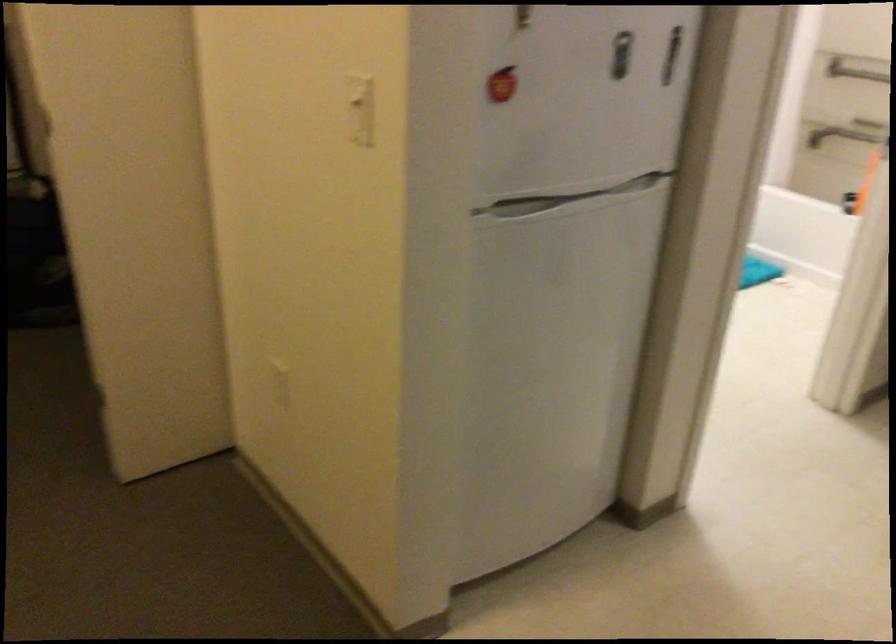
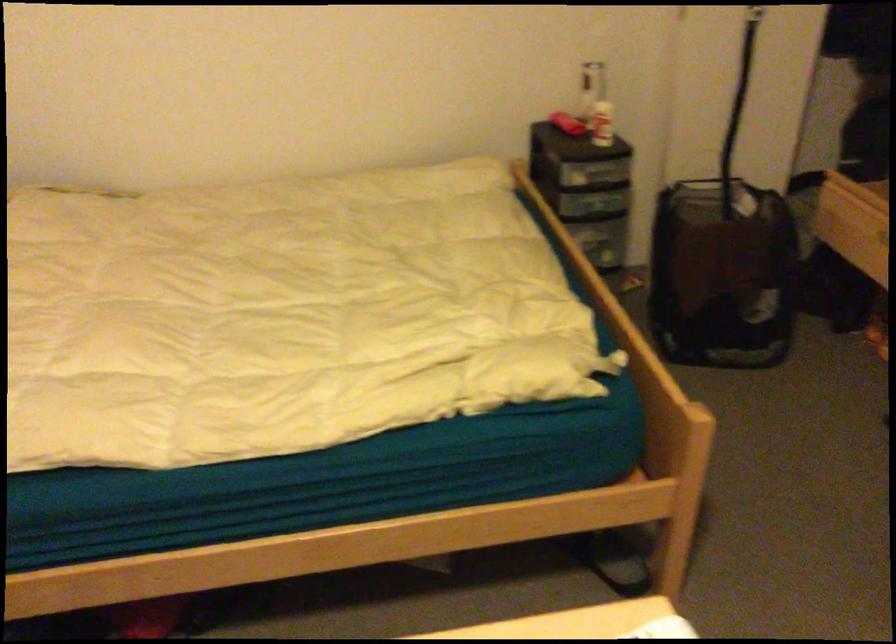
Question: What movement of the cameraman would produce the second image?

Choices:
 (A) Left
 (B) Right
 (C) Forward
 (D) Backward

Answer: (A)